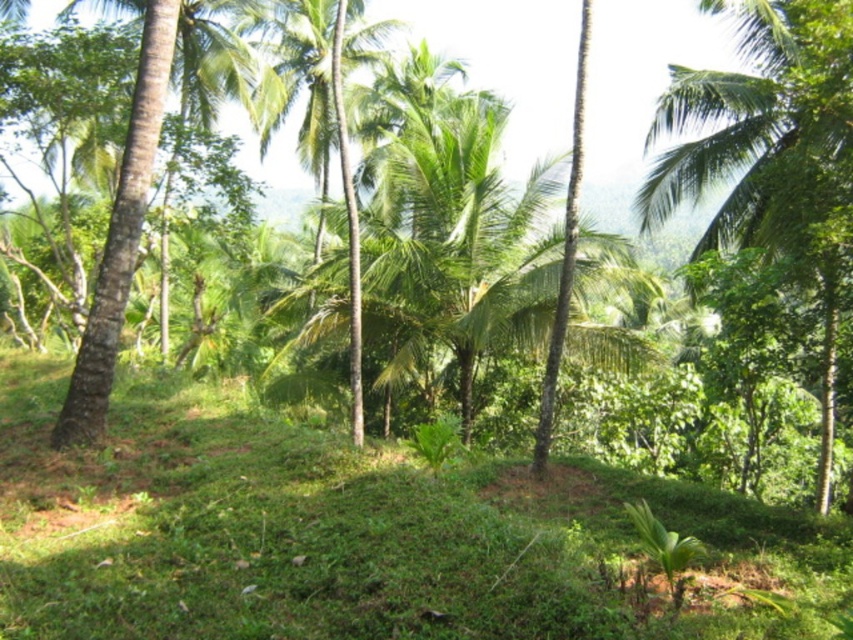
You are planning to plant a new palm tree in your garden. You have two options based on the image provided. The first option is the green leafy palm tree at upper right, and the second is the green leafy palm tree at center. If you want a narrower tree for space constraints, which one should you choose?

The green leafy palm tree at upper right is narrower than the green leafy palm tree at center, so you should choose the green leafy palm tree at upper right for space constraints.

You are a hiker trying to find a path through the tropical landscape. You see the green leafy palm tree at upper right and the green leafy palm tree at center. Which palm tree is closer to you?

The green leafy palm tree at upper right is closer to you because it is in front of the green leafy palm tree at center.